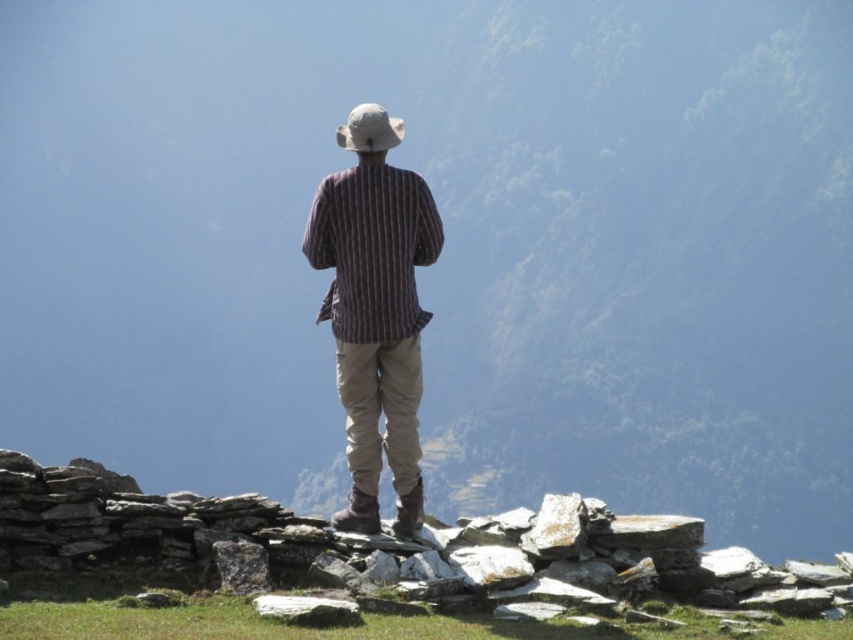
Based on the scene described, where is the striped fabric shirt at center located in terms of its 2D coordinates?

The striped fabric shirt at center is located at the 2D coordinates of point (375,310).

You are a photographer trying to capture both the striped fabric shirt at center and the striped cotton shirt at center in a single shot. Which shirt should you focus on first to ensure both are in focus?

You should focus on the striped fabric shirt at center first because it is closer to you than the striped cotton shirt at center, ensuring both will be in focus when using depth of field appropriately.

You are a photographer trying to capture the striped fabric shirt at center and the striped cotton shirt at center in the same frame. Since both shirts are at the center, which one do you need to focus on more carefully to ensure it appears in focus?

The striped fabric shirt at center is taller than the striped cotton shirt at center, so you should focus on the taller striped fabric shirt at center to ensure it is in focus.